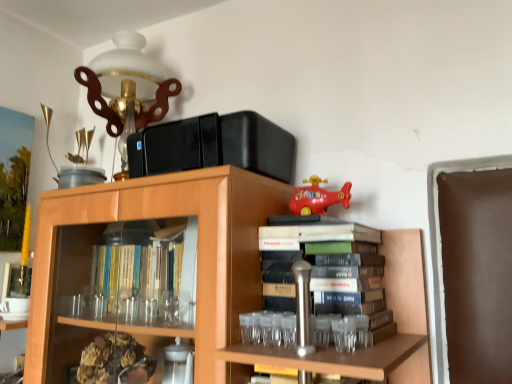
Question: Is wooden bookcase at upper center to the left of matte plastic toy helicopter at upper right from the viewer's perspective?

Choices:
 (A) yes
 (B) no

Answer: (A)

Question: From a real-world perspective, is wooden bookcase at upper center located higher than matte plastic toy helicopter at upper right?

Choices:
 (A) no
 (B) yes

Answer: (A)

Question: Would you say wooden bookcase at upper center contains matte plastic toy helicopter at upper right?

Choices:
 (A) yes
 (B) no

Answer: (A)

Question: Does wooden bookcase at upper center have a greater width compared to matte plastic toy helicopter at upper right?

Choices:
 (A) yes
 (B) no

Answer: (A)

Question: Is wooden bookcase at upper center completely or partially outside of matte plastic toy helicopter at upper right?

Choices:
 (A) yes
 (B) no

Answer: (A)

Question: Is wooden bookcase at upper center directly adjacent to matte plastic toy helicopter at upper right?

Choices:
 (A) yes
 (B) no

Answer: (B)

Question: Is matte plastic toy helicopter at upper right aimed at matte white glass table lamp at upper left?

Choices:
 (A) yes
 (B) no

Answer: (B)

Question: Would you say matte white glass table lamp at upper left is part of matte plastic toy helicopter at upper right's contents?

Choices:
 (A) no
 (B) yes

Answer: (A)

Question: Does matte plastic toy helicopter at upper right have a lesser height compared to matte white glass table lamp at upper left?

Choices:
 (A) no
 (B) yes

Answer: (B)

Question: Can we say matte plastic toy helicopter at upper right lies outside matte white glass table lamp at upper left?

Choices:
 (A) yes
 (B) no

Answer: (A)

Question: From a real-world perspective, is matte plastic toy helicopter at upper right positioned under matte white glass table lamp at upper left based on gravity?

Choices:
 (A) yes
 (B) no

Answer: (A)

Question: From the image's perspective, is matte plastic toy helicopter at upper right located beneath matte white glass table lamp at upper left?

Choices:
 (A) no
 (B) yes

Answer: (B)

Question: Can you confirm if matte plastic toy helicopter at upper right is thinner than wooden bookcase at upper center?

Choices:
 (A) yes
 (B) no

Answer: (A)